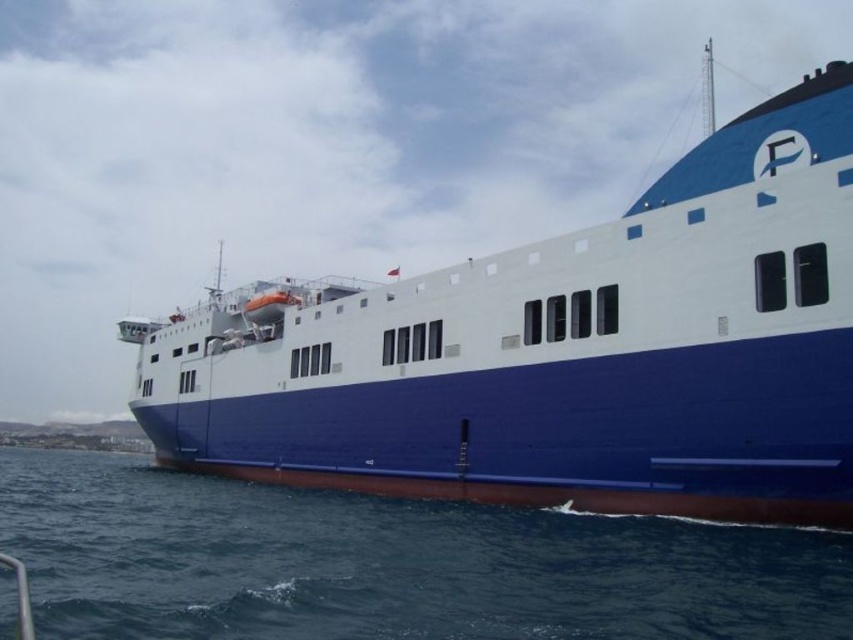
Who is taller, blue matte ship at center or blue smooth water at lower center?

Standing taller between the two is blue matte ship at center.

Is blue matte ship at center above blue smooth water at lower center?

Indeed, blue matte ship at center is positioned over blue smooth water at lower center.

Is point (561, 307) closer to camera compared to point (416, 556)?

No, it is not.

Find the location of a particular element. blue matte ship at center is located at coordinates (561, 352).